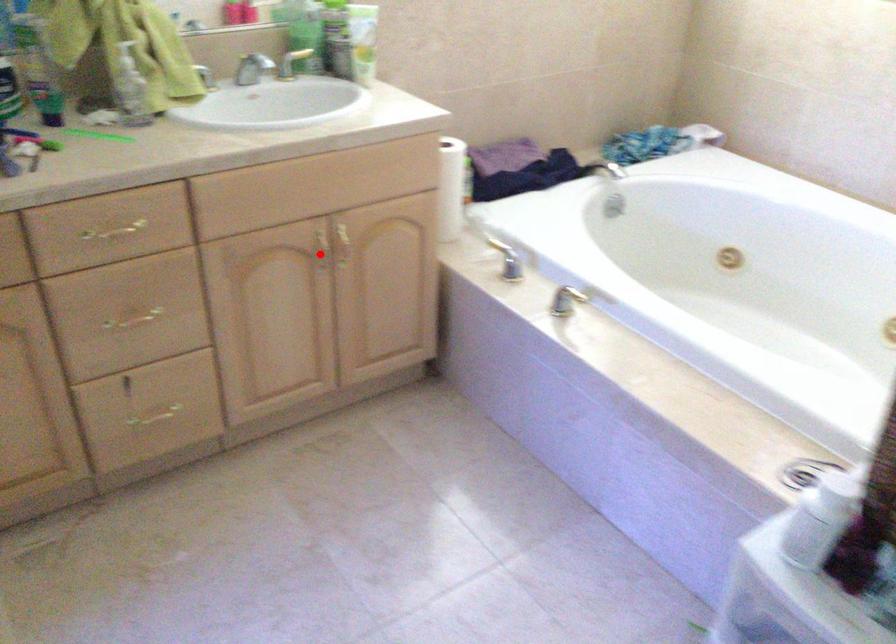
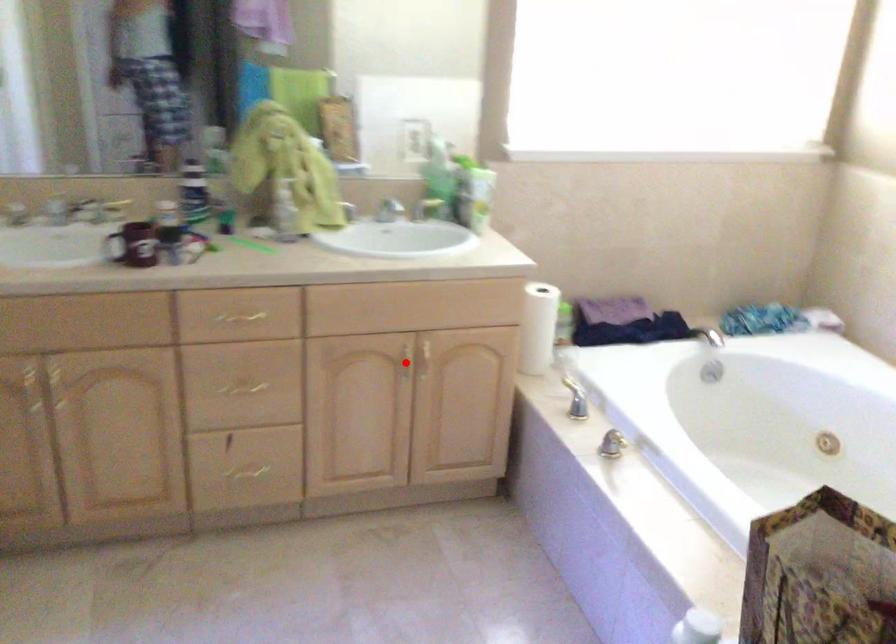
I am providing you with two images of the same scene from different viewpoints. A red point is marked on the first image and another point is marked on the second image. Are the points marked in image1 and image2 representing the same 3D position?

Yes